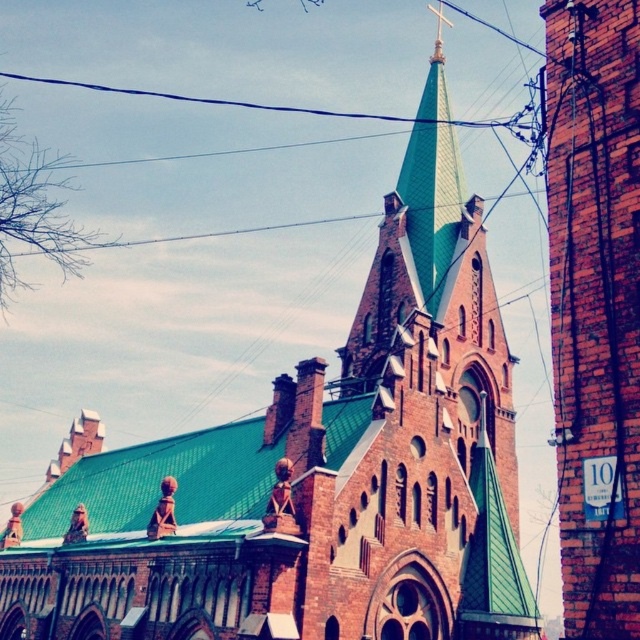
Does green tiled spire at center have a lesser width compared to black wire at upper center?

Yes, green tiled spire at center is thinner than black wire at upper center.

Is green tiled spire at center behind black wire at upper center?

No, it is not.

The image size is (640, 640). Identify the location of green tiled spire at center. (432, 182).

Where is `green tiled spire at center`? Image resolution: width=640 pixels, height=640 pixels. green tiled spire at center is located at coordinates (432, 182).